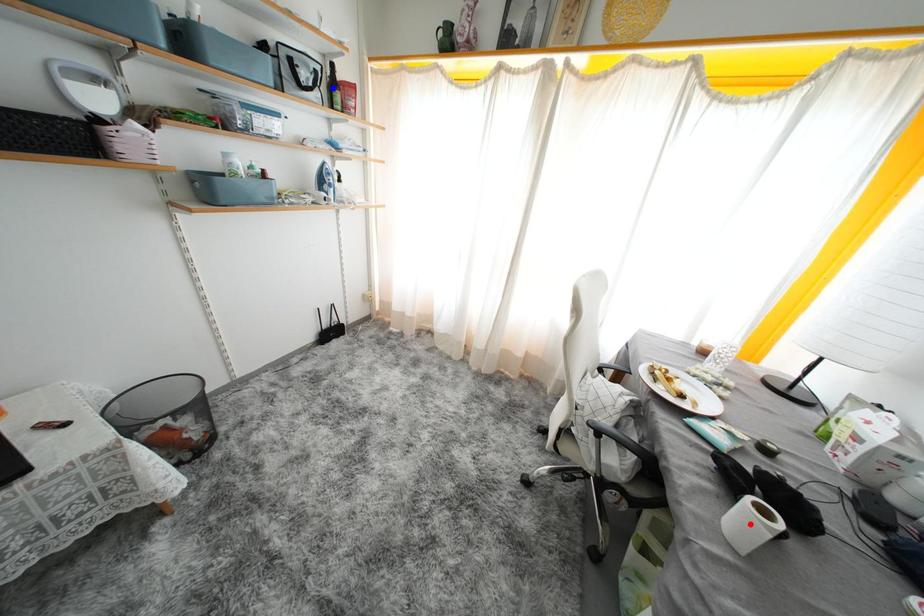
Question: In the image, two points are highlighted. Which point is nearer to the camera? Reply with the corresponding letter.

Choices:
 (A) blue point
 (B) red point

Answer: (B)